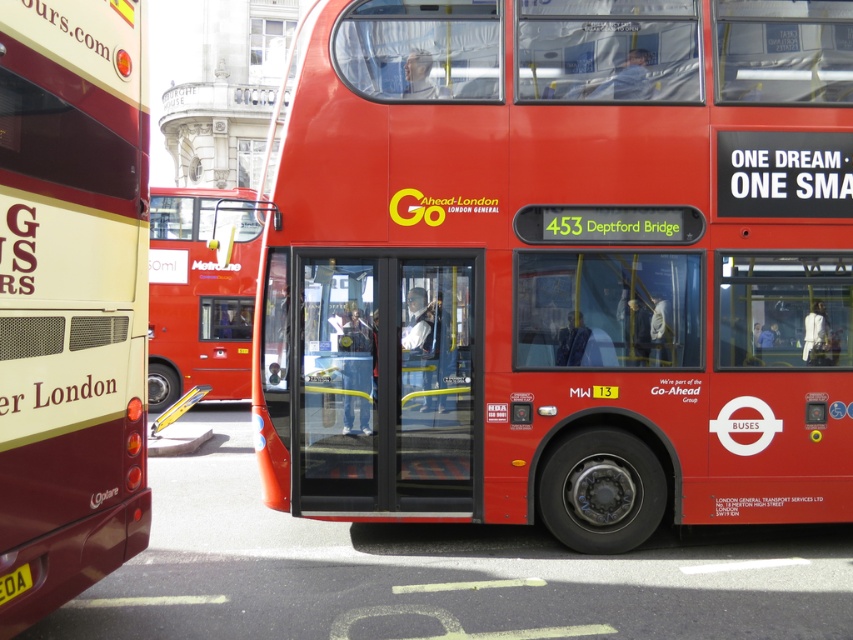
Does point (21, 284) come in front of point (195, 196)?

Yes, point (21, 284) is closer to viewer.

Does matte gold bus at left appear on the right side of red matte bus at center?

Correct, you'll find matte gold bus at left to the right of red matte bus at center.

Which is in front, point (138, 216) or point (219, 228)?

Point (138, 216) is more forward.

The width and height of the screenshot is (853, 640). What are the coordinates of `matte gold bus at left` in the screenshot? It's located at (71, 296).

Can you confirm if shiny red bus at center is positioned to the right of matte gold bus at left?

Yes, shiny red bus at center is to the right of matte gold bus at left.

Who is more distant from viewer, (328, 362) or (62, 134)?

Positioned behind is point (328, 362).

The image size is (853, 640). Find the location of `shiny red bus at center`. shiny red bus at center is located at coordinates (561, 266).

Looking at this image, is shiny red bus at center behind red matte bus at center?

That is False.

Is point (527, 86) positioned after point (177, 348)?

No, it is not.

The height and width of the screenshot is (640, 853). Find the location of `shiny red bus at center`. shiny red bus at center is located at coordinates (561, 266).